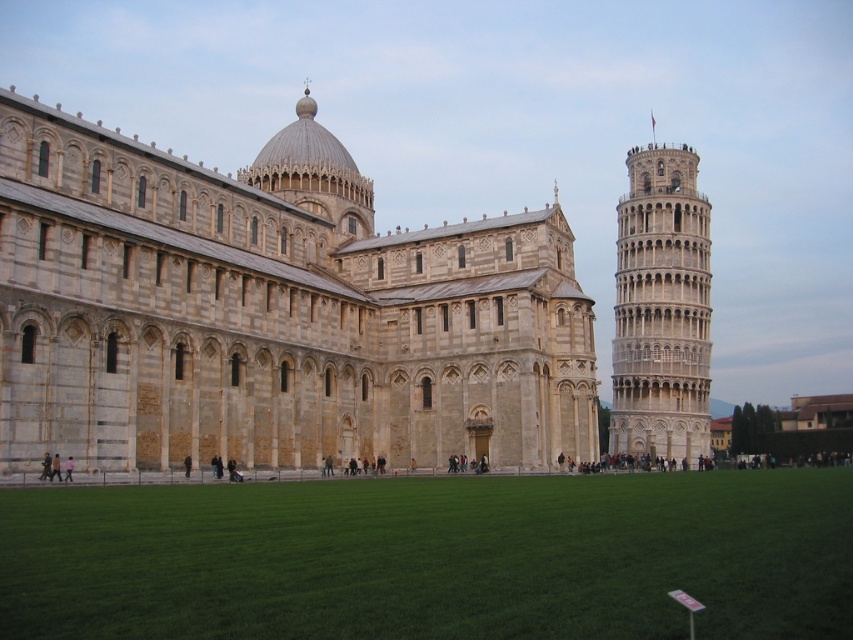
You are standing in the Piazza dei Miracoli and want to take a photo of both the light beige stone cathedral at center and the light beige stone tower at right. Which one should you position closer to you to include both in the frame without one blocking the other?

You should position yourself closer to the light beige stone cathedral at center because it is in front of the light beige stone tower at right, so placing it nearer will ensure both are visible without overlap.

You are standing at the entrance of Piazza dei Miracoli and want to reach the point marked at coordinates (247, 172). Given that the distance from your current position to this point is 88.49 meters, can you estimate how long it would take you to walk there at a normal pace?

The distance to the point is 88.49 meters. At a normal walking pace of approximately 1.4 meters per second, it would take roughly 63 seconds, or about 1 minute, to reach the point marked at coordinates (247, 172).

You are standing in the Piazza dei Miracoli and want to take a photo of both the light beige stone cathedral at center and the light beige stone tower at right. Which direction should you face to ensure both landmarks are visible in your frame?

You should face to the left of the light beige stone tower at right to include both the light beige stone cathedral at center and the light beige stone tower at right in your photo, since the cathedral is positioned to the left of the tower.